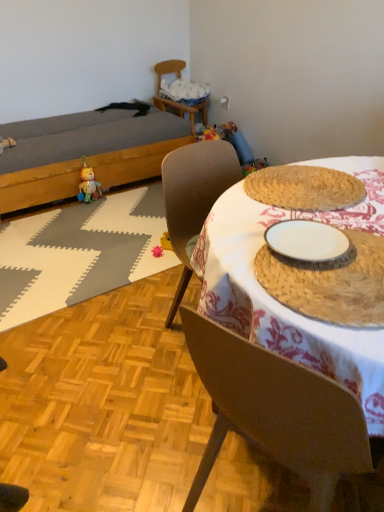
Question: From a real-world perspective, is rattan placemat at center above or below white matte plate at center?

Choices:
 (A) above
 (B) below

Answer: (B)

Question: Looking at the image, does rattan placemat at center seem bigger or smaller compared to white matte plate at center?

Choices:
 (A) small
 (B) big

Answer: (B)

Question: Which object is the farthest from the rattan placemat at center?

Choices:
 (A) woven straw placemat at center
 (B) white matte plate at center
 (C) wooden chair at upper center
 (D) matte gray bed at left
 (E) pink rubber toy at center, which is the 2th toy in top-to-bottom order

Answer: (C)

Question: Estimate the real-world distances between objects in this image. Which object is farther from the plush yellow bear at lower left, the second toy from the right?

Choices:
 (A) white ceramic plate at center
 (B) rattan placemat at center
 (C) wooden chair at upper center
 (D) pink rubber toy at center, which is the 2th toy in top-to-bottom order
 (E) matte gray bed at left

Answer: (A)